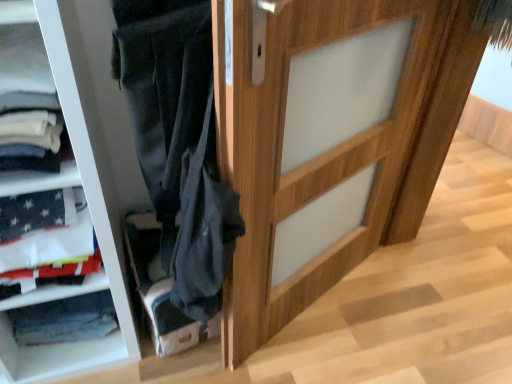
Image resolution: width=512 pixels, height=384 pixels. What are the coordinates of `vacant area that is situated to the right of velvet dark blue pants at lower center` in the screenshot? It's located at (237, 362).